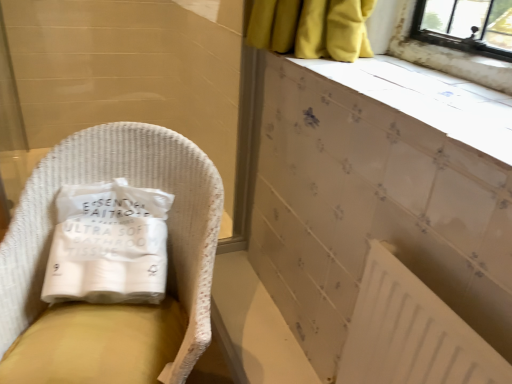
Question: Choose the correct answer: Is white paper towel at left inside white textured ledge at upper right or outside it?

Choices:
 (A) inside
 (B) outside

Answer: (B)

Question: Is point (76, 216) closer or farther from the camera than point (501, 127)?

Choices:
 (A) closer
 (B) farther

Answer: (B)

Question: Which of these objects is positioned farthest from the white wicker chair at left?

Choices:
 (A) white matte radiator at lower right
 (B) white paper towel at left
 (C) white textured ledge at upper right

Answer: (C)

Question: Estimate the real-world distances between objects in this image. Which object is closer to the white textured ledge at upper right?

Choices:
 (A) white paper towel at left
 (B) white matte radiator at lower right
 (C) white wicker chair at left

Answer: (B)